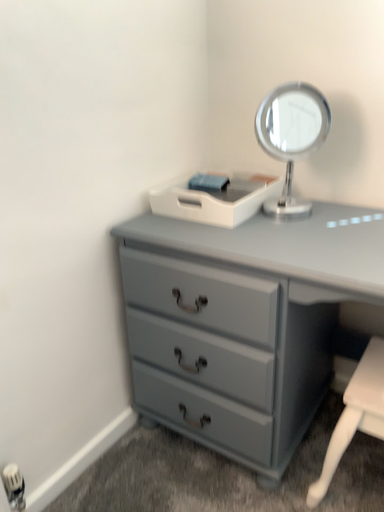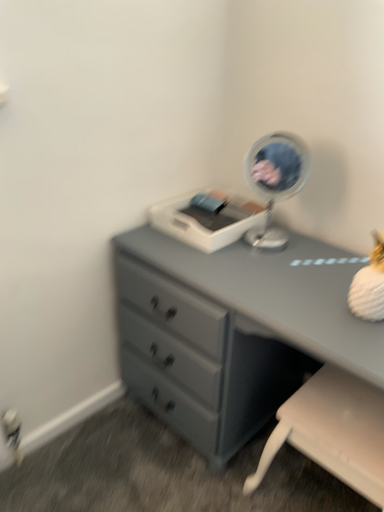
Question: How did the camera likely rotate when shooting the video?

Choices:
 (A) rotated left
 (B) rotated right

Answer: (A)